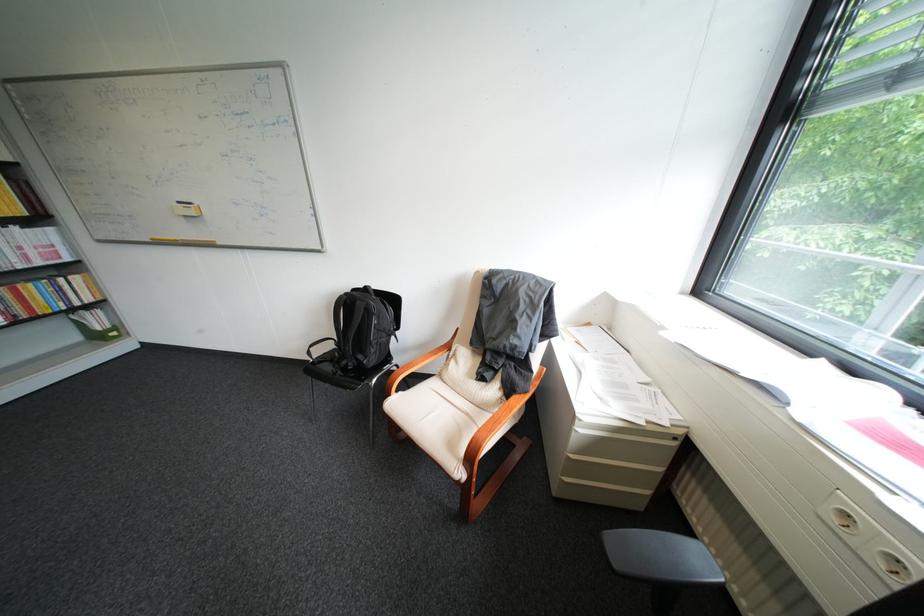
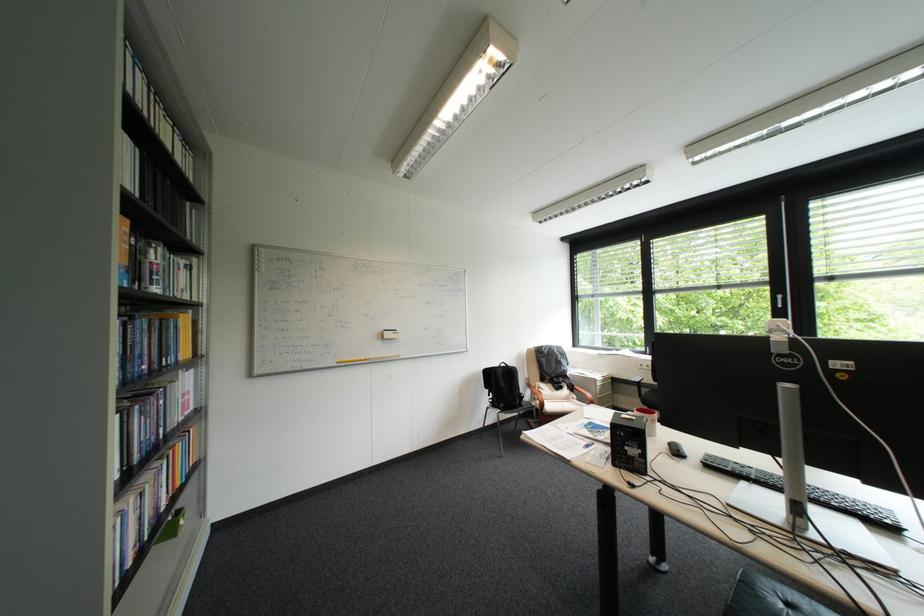
Where in the second image is the point corresponding to (164,238) from the first image?

(350, 361)